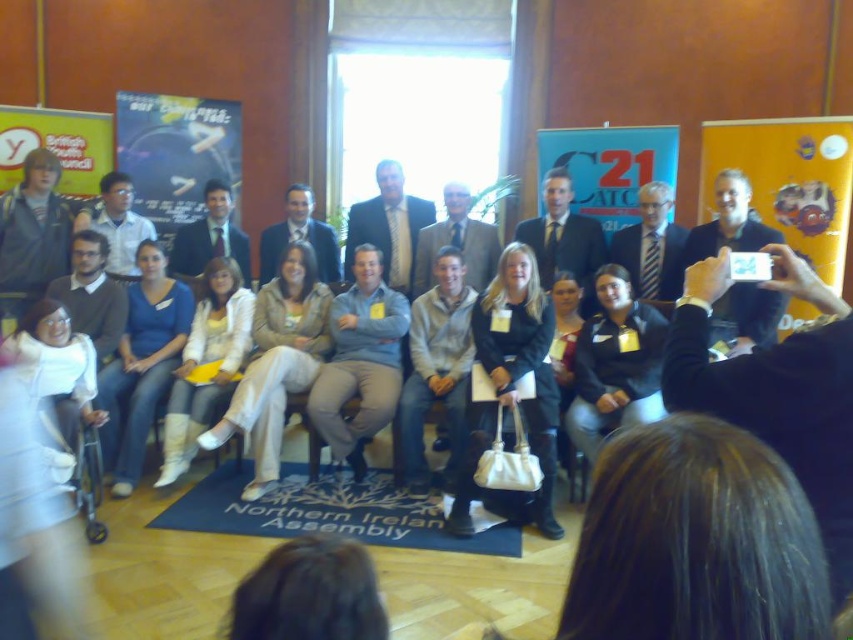
Is yellow paper at right to the left of matte gray suit at center from the viewer's perspective?

In fact, yellow paper at right is to the right of matte gray suit at center.

Is yellow paper at right to the right of matte gray suit at center from the viewer's perspective?

Yes, yellow paper at right is to the right of matte gray suit at center.

Which is behind, point (701, 209) or point (316, 236)?

Point (316, 236)

At what (x,y) coordinates should I click in order to perform the action: click on yellow paper at right. Please return your answer as a coordinate pair (x, y). This screenshot has height=640, width=853. Looking at the image, I should click on (788, 180).

Between black leather jacket at center and light brown suit at center, which one has less height?

light brown suit at center is shorter.

Between black leather jacket at center and light brown suit at center, which one is positioned higher?

light brown suit at center is higher up.

The image size is (853, 640). What do you see at coordinates (512, 381) in the screenshot? I see `black leather jacket at center` at bounding box center [512, 381].

You are a GUI agent. You are given a task and a screenshot of the screen. Output one action in this format:
    pyautogui.click(x=<x>, y=<y>)
    Task: Click on the black leather jacket at center
    The width and height of the screenshot is (853, 640).
    Given the screenshot: What is the action you would take?
    pyautogui.click(x=512, y=381)

Between denim jeans at center and white leather boots at lower left, which one appears on the left side from the viewer's perspective?

Positioned to the left is denim jeans at center.

Is denim jeans at center in front of white leather boots at lower left?

That is True.

Identify the location of denim jeans at center. This screenshot has width=853, height=640. (141, 364).